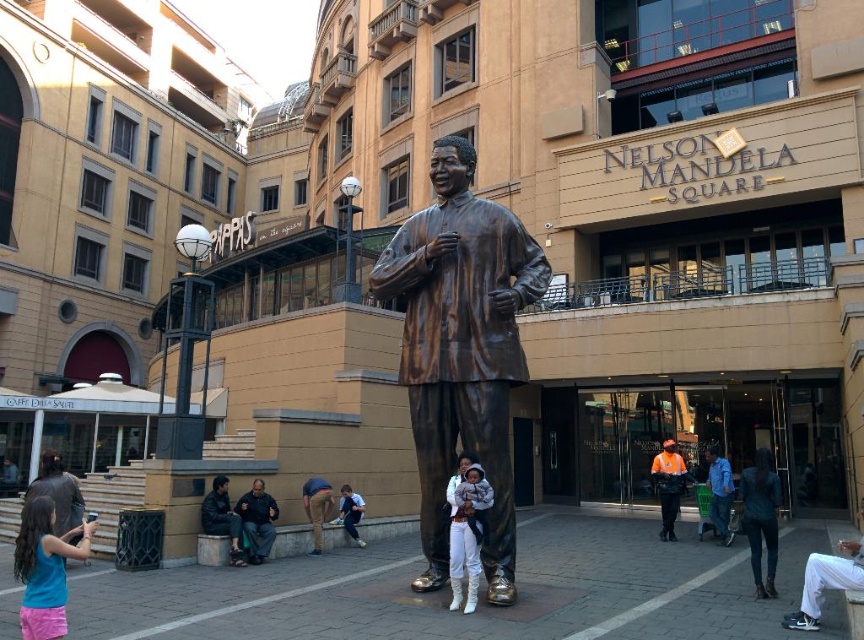
Question: Does leather jacket at lower center appear on the right side of light blue denim jeans at lower center?

Choices:
 (A) no
 (B) yes

Answer: (A)

Question: From the image, what is the correct spatial relationship of reflective orange vest at center in relation to blue fabric jacket at center?

Choices:
 (A) above
 (B) below

Answer: (B)

Question: Which of the following is the farthest from the observer?

Choices:
 (A) white fleece jacket at lower center
 (B) reflective orange vest at center
 (C) bronze statue at center

Answer: (B)

Question: Is the position of reflective orange vest at center less distant than that of brown leather pants at lower center?

Choices:
 (A) no
 (B) yes

Answer: (A)

Question: Estimate the real-world distances between objects in this image. Which object is closer to the bronze statue at center?

Choices:
 (A) brown leather pants at lower center
 (B) reflective orange vest at center

Answer: (A)

Question: Which point is closer to the camera?

Choices:
 (A) (480, 564)
 (B) (359, 516)
 (C) (53, 600)
 (D) (272, 531)

Answer: (C)